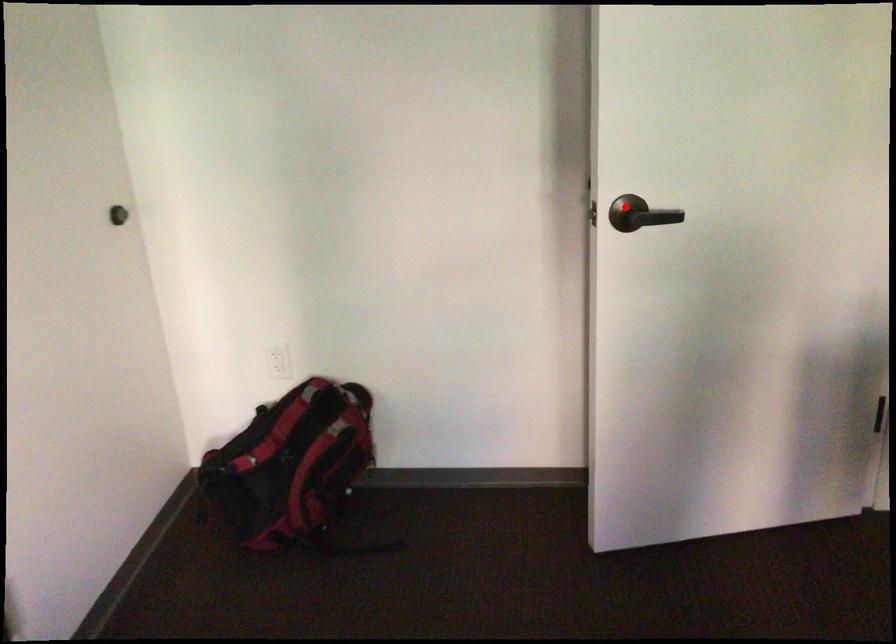
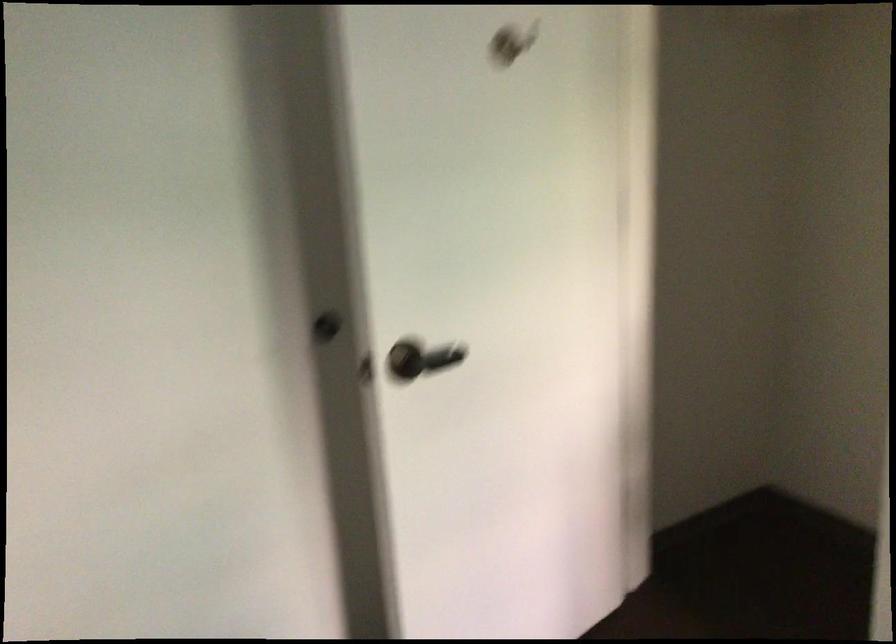
Question: I am providing you with two images of the same scene from different viewpoints. A red point is shown in image1. For the corresponding object point in image2, is it positioned nearer or farther from the camera?

Choices:
 (A) Nearer
 (B) Farther

Answer: (A)